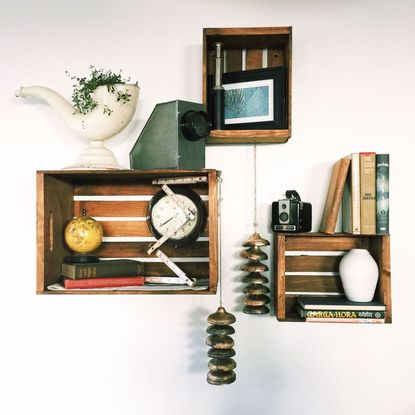
Find the location of a particular element. This screenshot has height=415, width=415. book is located at coordinates (325, 303).